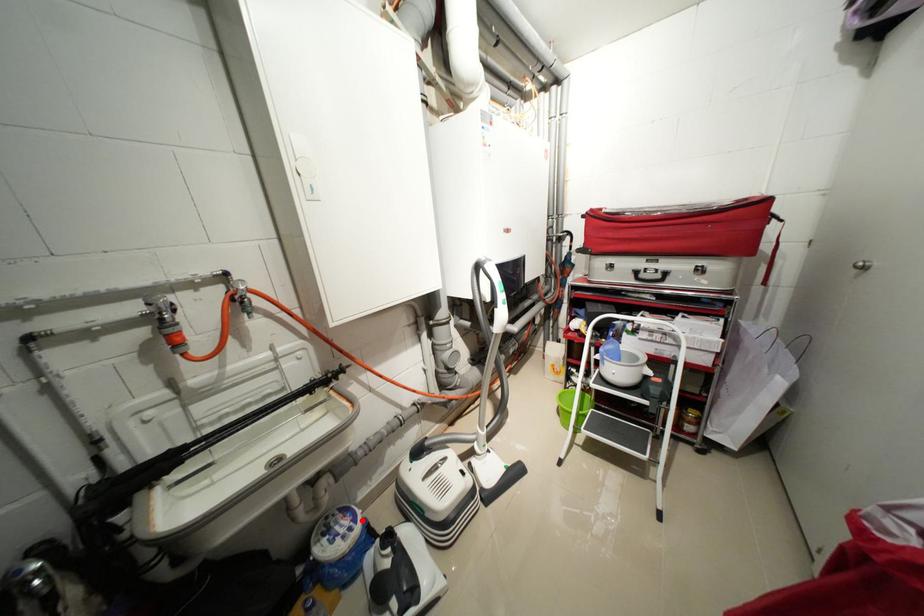
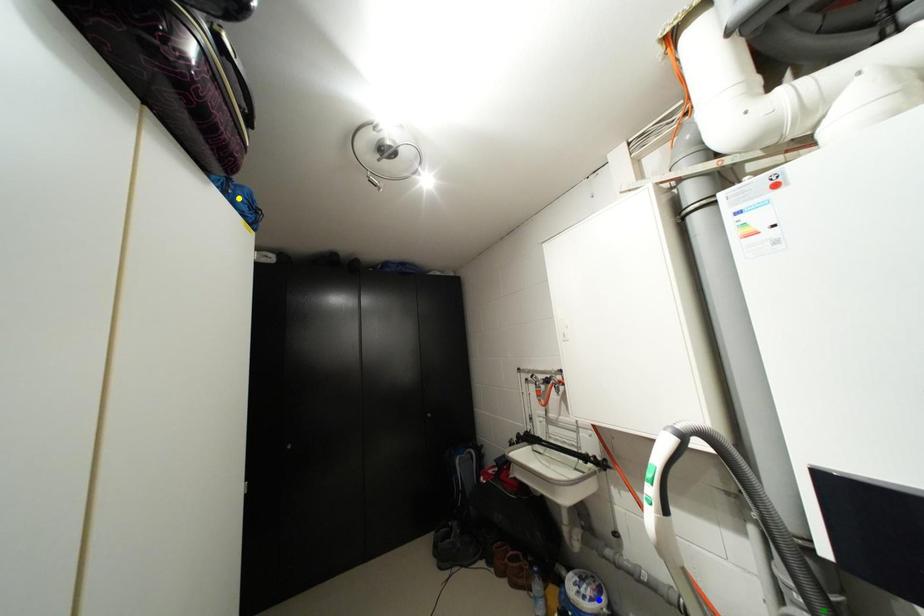
Question: I am providing you with two images of the same scene from different viewpoints. A red point is marked on the first image. You are given multiple points on the second image. Can you choose the point in image 2 that corresponds to the point in image 1?

Choices:
 (A) yellow point
 (B) blue point
 (C) green point

Answer: (B)